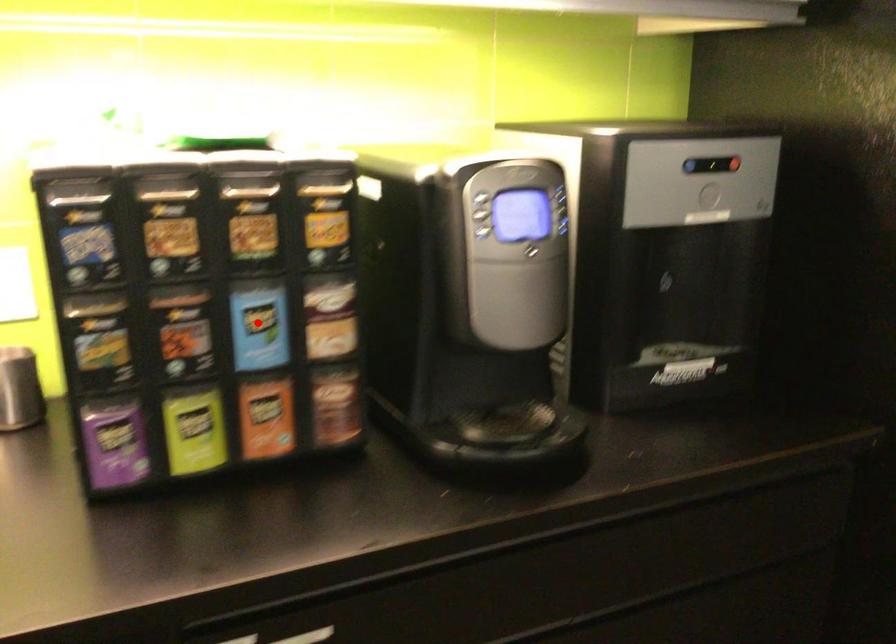
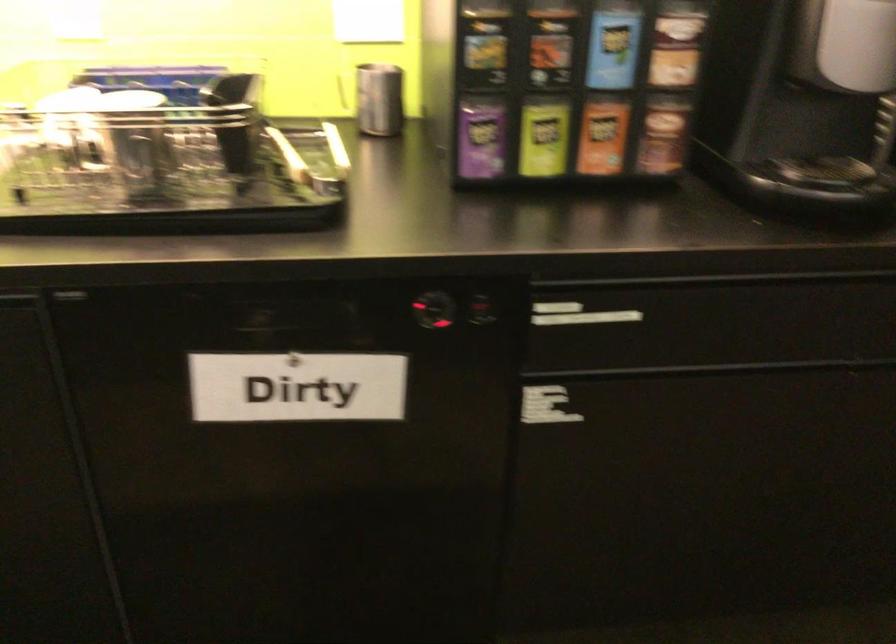
Find the pixel in the second image that matches the highlighted location in the first image.

(613, 44)